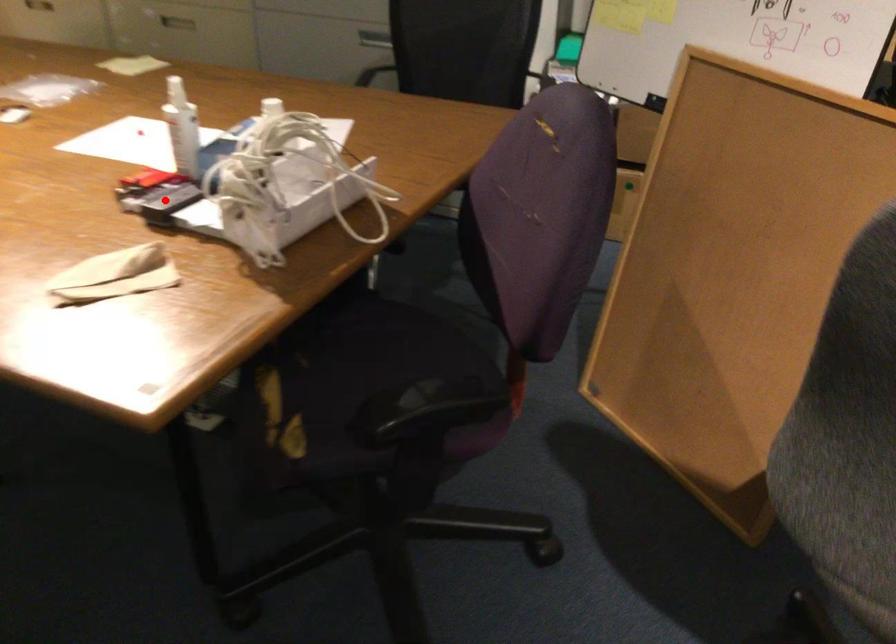
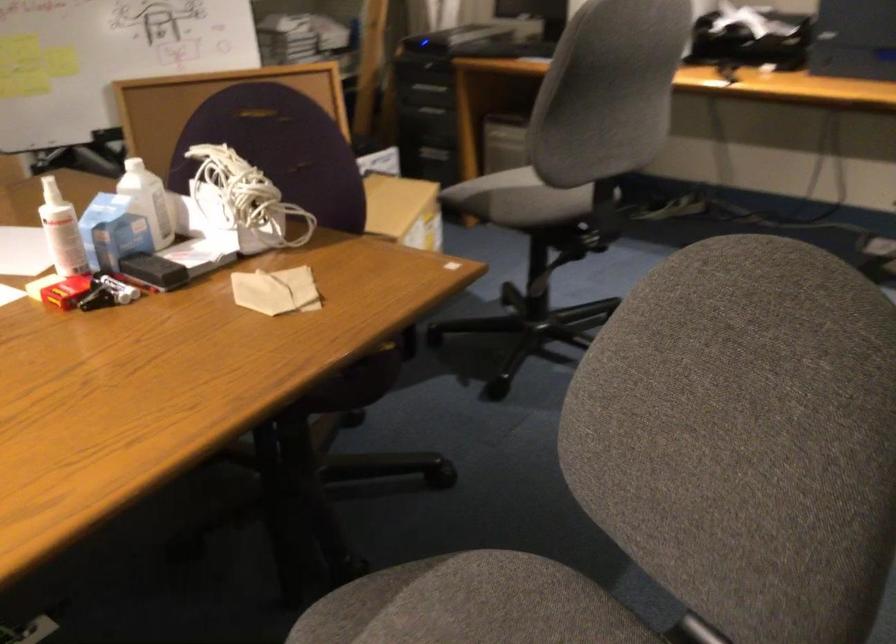
Find the pixel in the second image that matches the highlighted location in the first image.

(152, 270)